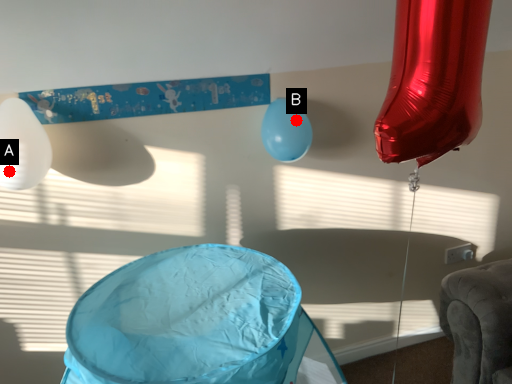
Question: Two points are circled on the image, labeled by A and B beside each circle. Which point is further to the camera?

Choices:
 (A) A is further
 (B) B is further

Answer: (B)